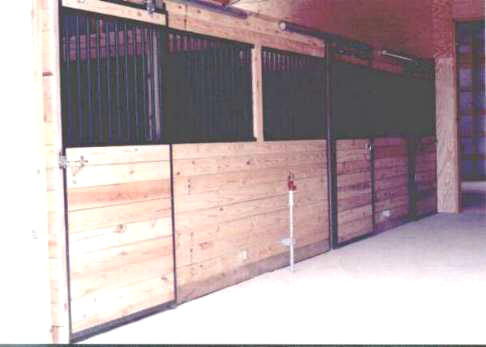
Find the location of a particular element. This screenshot has height=347, width=486. bar is located at coordinates (68, 89).